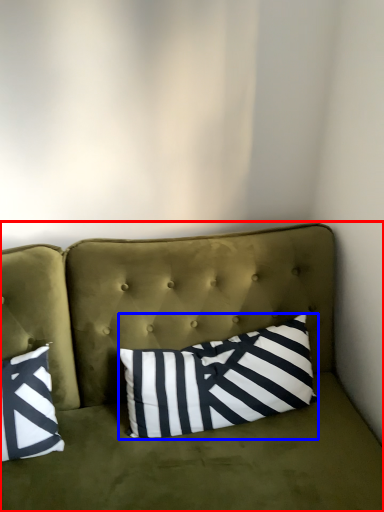
Question: Among these objects, which one is nearest to the camera, studio couch (highlighted by a red box) or pillow (highlighted by a blue box)?

Choices:
 (A) studio couch
 (B) pillow

Answer: (A)